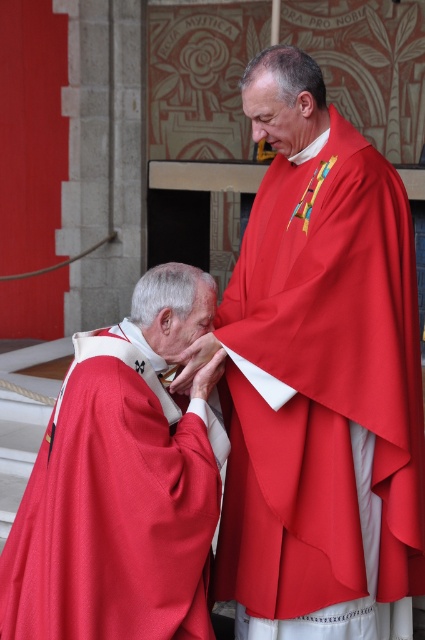
You are an observer standing in front of the scene. You see the matte red robe at center and the matte red cape at left. Which one is covering the other?

The matte red robe at center is positioned over the matte red cape at left, so it is covering the cape.

You are a photographer setting up a camera at the back of the scene. You want to capture both the matte red robe at center and the matte red cape at left in the same frame. Given that the camera has a fixed focal length, which object should you position closer to the camera to ensure both are in focus?

The matte red robe at center is much taller than the matte red cape at left. To ensure both are in focus, position the matte red robe at center closer to the camera since its larger size can still maintain focus while the smaller matte red cape at left will also be within the focal range.

You are an observer in the scene. You notice the matte red robe at center and the matte red cape at left. Which object is closer to you?

The matte red robe at center is closer to you because the matte red cape at left is behind it.